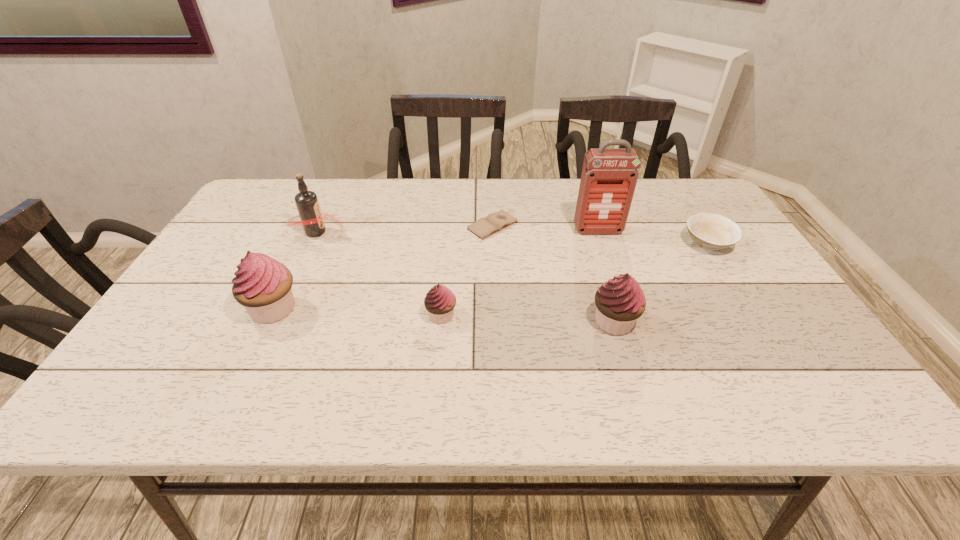
In order to click on the leftmost cupcake in this screenshot , I will do `click(262, 285)`.

I want to click on the fifth object from right to left, so click(x=440, y=301).

Locate an element on the screen. The image size is (960, 540). the shortest cupcake is located at coordinates pyautogui.click(x=440, y=301).

Identify the location of the rightmost cupcake. (620, 301).

This screenshot has height=540, width=960. I want to click on the fourth tallest object, so tap(620, 301).

Locate an element on the screen. This screenshot has width=960, height=540. the tallest object is located at coordinates (609, 176).

The height and width of the screenshot is (540, 960). In order to click on the shortest object in this screenshot , I will do `click(484, 227)`.

Where is `diary`? diary is located at coordinates (484, 227).

Where is `root beer`? This screenshot has width=960, height=540. root beer is located at coordinates click(312, 219).

In order to click on the rightmost object in this screenshot , I will do `click(709, 231)`.